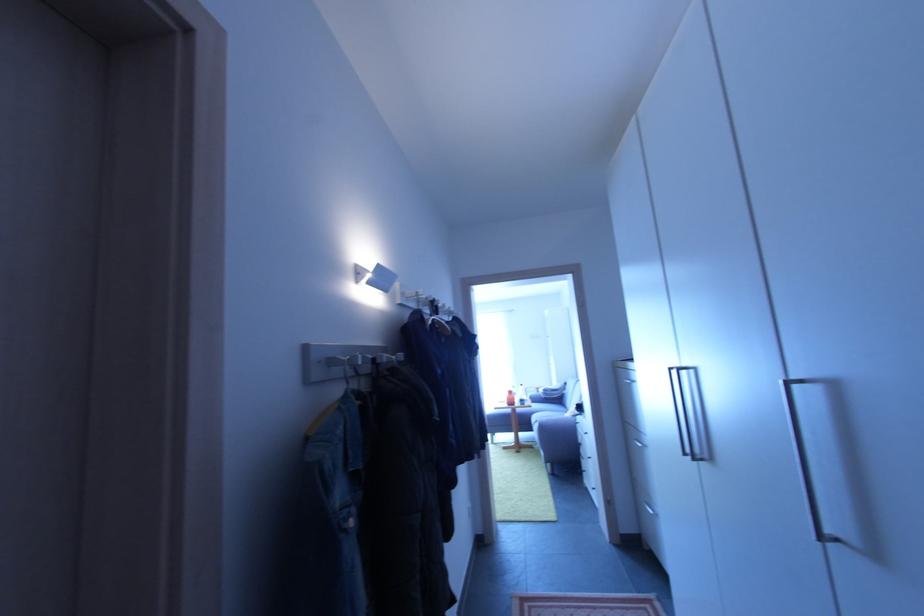
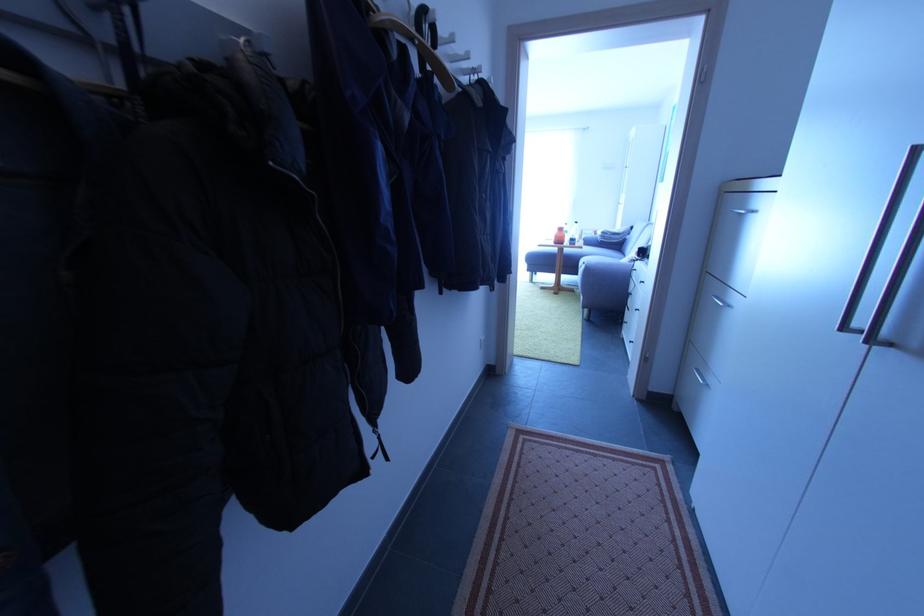
In the second image, find the point that corresponds to (444,333) in the first image.

(441, 82)